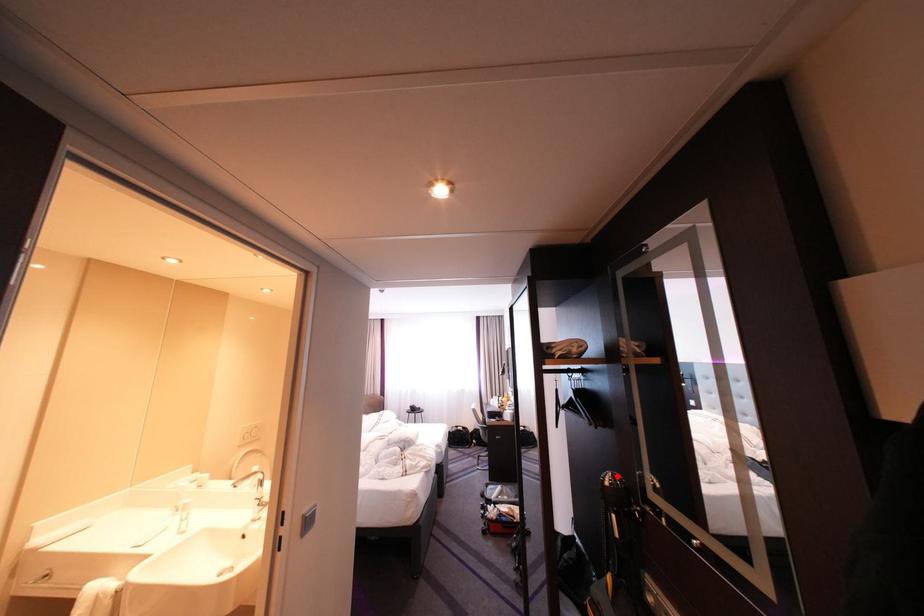
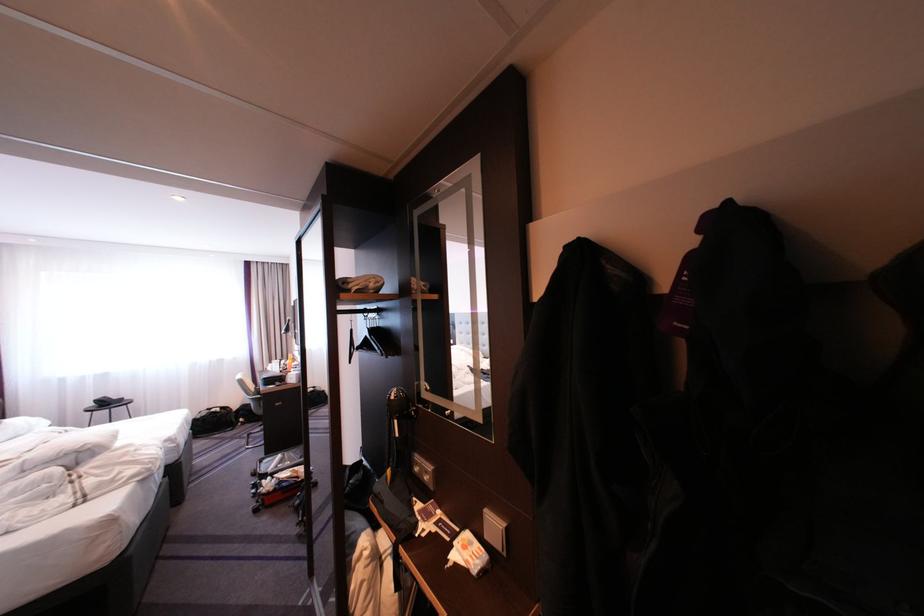
Locate, in the second image, the point that corresponds to the highlighted location in the first image.

(404, 392)